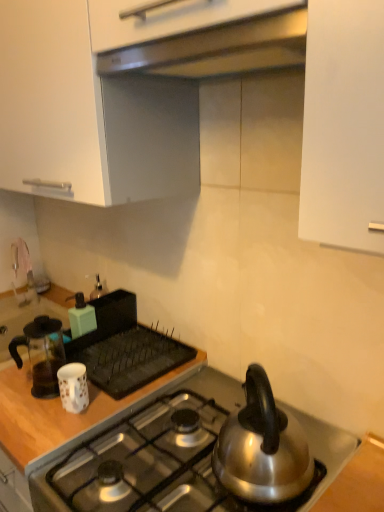
Where is `free space on the front side of transparent glass coffee pot at left, arranged as the second kitchen appliance when viewed from the back`? The image size is (384, 512). free space on the front side of transparent glass coffee pot at left, arranged as the second kitchen appliance when viewed from the back is located at coordinates (31, 408).